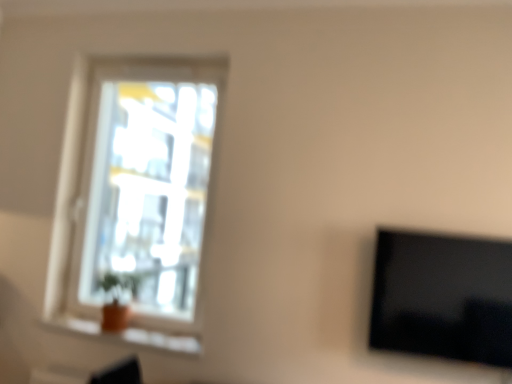
Question: Is orange clay pot at lower left outside of transparent glass window at upper left?

Choices:
 (A) yes
 (B) no

Answer: (A)

Question: Is orange clay pot at lower left surrounding transparent glass window at upper left?

Choices:
 (A) yes
 (B) no

Answer: (B)

Question: Does orange clay pot at lower left have a greater width compared to transparent glass window at upper left?

Choices:
 (A) yes
 (B) no

Answer: (B)

Question: From the image's perspective, is orange clay pot at lower left on top of transparent glass window at upper left?

Choices:
 (A) no
 (B) yes

Answer: (A)

Question: Does orange clay pot at lower left appear on the left side of transparent glass window at upper left?

Choices:
 (A) yes
 (B) no

Answer: (A)

Question: Is orange clay pot at lower left looking in the opposite direction of transparent glass window at upper left?

Choices:
 (A) no
 (B) yes

Answer: (A)

Question: From the image's perspective, is black glossy tv at right above orange clay pot at lower left?

Choices:
 (A) yes
 (B) no

Answer: (A)

Question: From a real-world perspective, is black glossy tv at right on orange clay pot at lower left?

Choices:
 (A) yes
 (B) no

Answer: (A)

Question: Is black glossy tv at right closer to camera compared to orange clay pot at lower left?

Choices:
 (A) no
 (B) yes

Answer: (B)

Question: Can orange clay pot at lower left be found inside black glossy tv at right?

Choices:
 (A) yes
 (B) no

Answer: (B)

Question: Is black glossy tv at right directly adjacent to orange clay pot at lower left?

Choices:
 (A) no
 (B) yes

Answer: (A)

Question: Is black glossy tv at right far away from orange clay pot at lower left?

Choices:
 (A) no
 (B) yes

Answer: (B)

Question: Does transparent glass window at upper left have a greater width compared to black glossy tv at right?

Choices:
 (A) no
 (B) yes

Answer: (B)